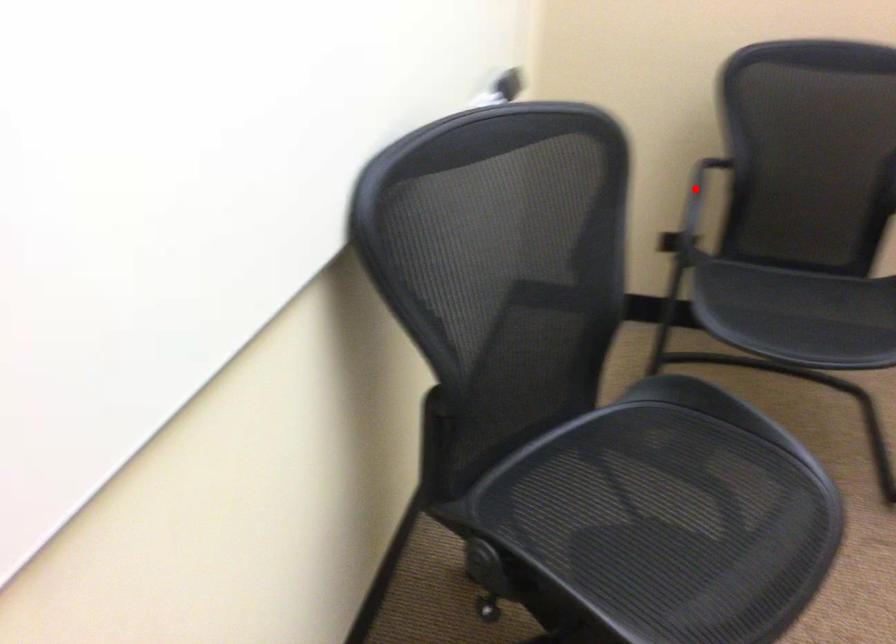
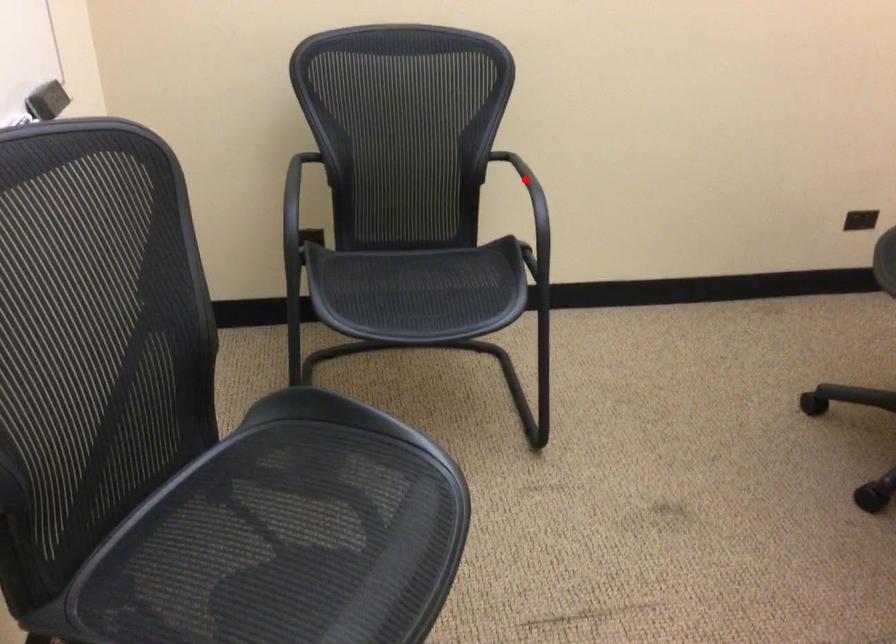
I am providing you with two images of the same scene from different viewpoints. A red point is marked on the first image and another point is marked on the second image. Is the red point in image1 aligned with the point shown in image2?

No